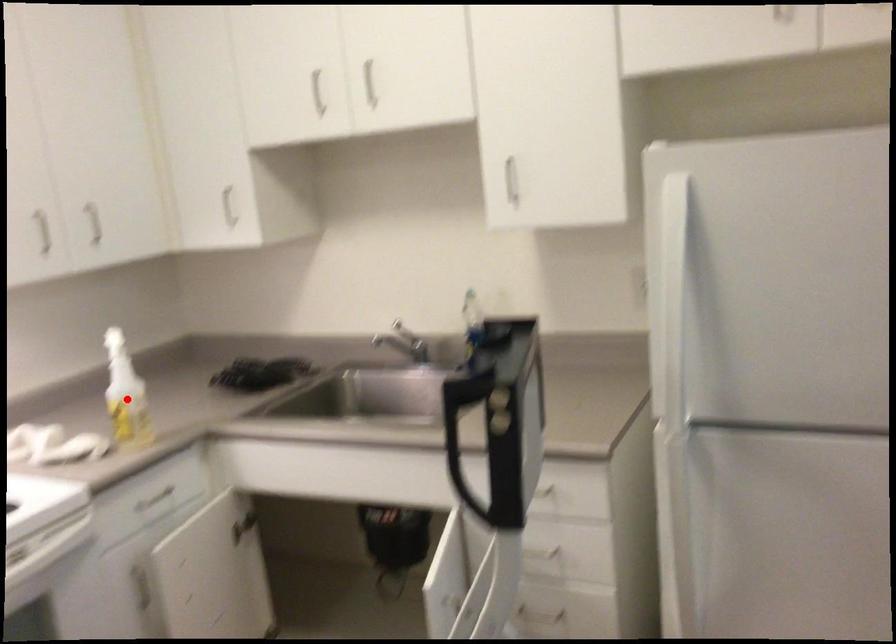
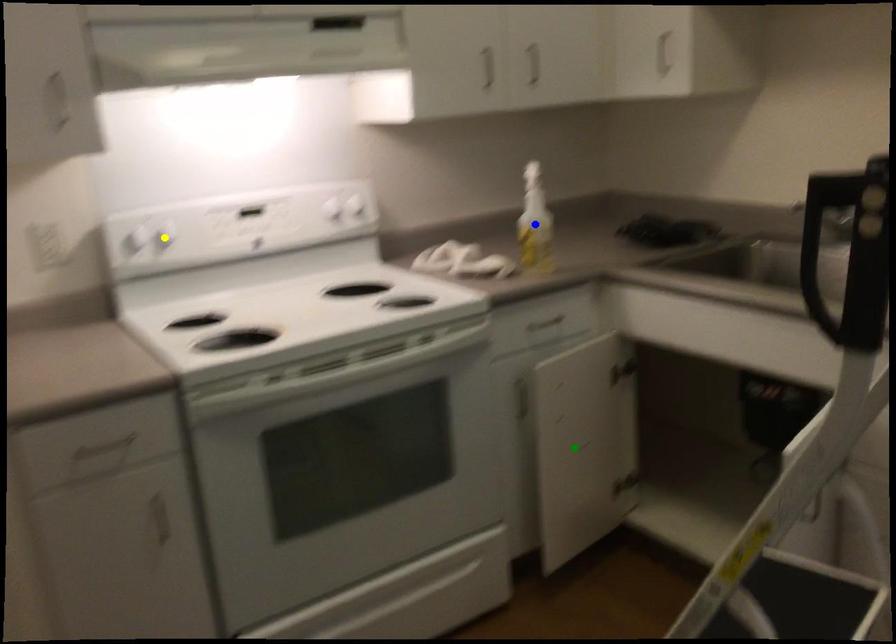
Question: I am providing you with two images of the same scene from different viewpoints. A red point is marked on the first image. You are given multiple points on the second image. Which point in image 2 represents the same 3d spot as the red point in image 1?

Choices:
 (A) green point
 (B) yellow point
 (C) blue point

Answer: (C)